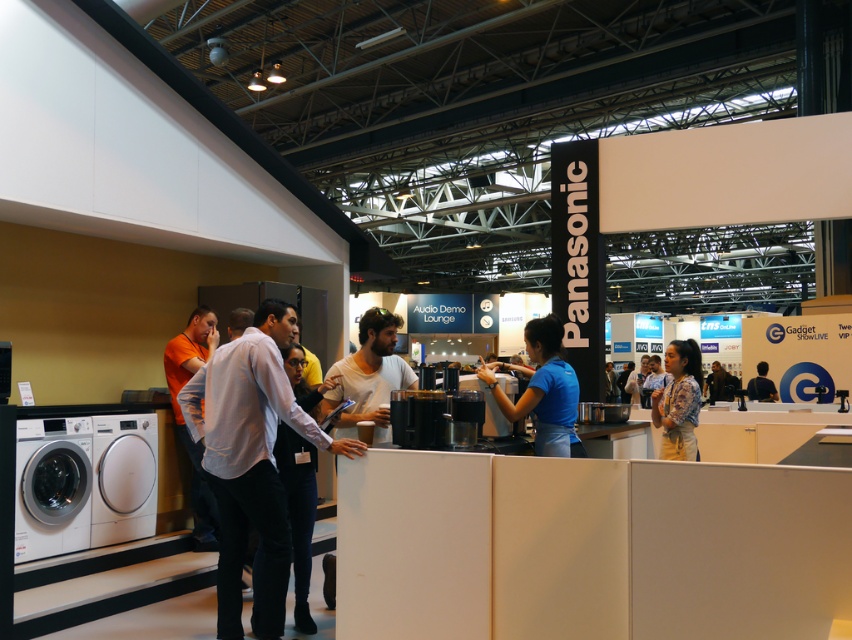
You are a photographer at the exhibition. You want to take a photo of the white shirt at center and the white glossy washing machine at lower left. Based on their sizes, which one should you focus on first if you want to ensure both are in frame without moving the camera?

The white shirt at center is taller than the white glossy washing machine at lower left. To ensure both are in frame, focus on the taller object first, which is the white shirt at center, as it requires more vertical space.

From the picture: You are a photographer at the exhibition and want to capture both the white shirt at center and the printed fabric blouse at center in a single frame. Based on their positions, which one should you focus on first to ensure both are in the shot?

The white shirt at center should be focused on first since it is positioned to the left of the printed fabric blouse at center, allowing the photographer to frame both by starting from the left side.